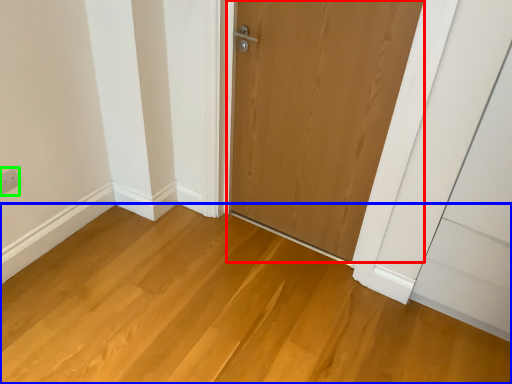
Question: Considering the real-world distances, which object is farthest from door (highlighted by a red box)? plain (highlighted by a blue box) or electric outlet (highlighted by a green box)?

Choices:
 (A) plain
 (B) electric outlet

Answer: (B)